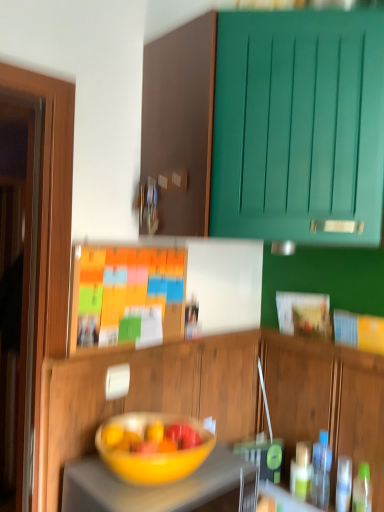
Question: From a real-world perspective, is wooden cabinet at center, which is the 2th cabinetry in top-to-bottom order, physically below matte yellow bowl at center?

Choices:
 (A) yes
 (B) no

Answer: (A)

Question: Is wooden cabinet at center, which is the 1th cabinetry from bottom to top, at the right side of matte yellow bowl at center?

Choices:
 (A) yes
 (B) no

Answer: (B)

Question: Is wooden cabinet at center, which is the 2th cabinetry in top-to-bottom order, closer to the viewer compared to matte yellow bowl at center?

Choices:
 (A) no
 (B) yes

Answer: (A)

Question: Is wooden cabinet at center, which is the 1th cabinetry from bottom to top, directly adjacent to matte yellow bowl at center?

Choices:
 (A) no
 (B) yes

Answer: (A)

Question: Does wooden cabinet at center, which is the 2th cabinetry in top-to-bottom order, have a smaller size compared to matte yellow bowl at center?

Choices:
 (A) no
 (B) yes

Answer: (A)

Question: Is yellow matte bowl at center wider or thinner than wooden cabinet at center, which is the 1th cabinetry from bottom to top?

Choices:
 (A) thin
 (B) wide

Answer: (B)

Question: In the image, is yellow matte bowl at center positioned in front of or behind wooden cabinet at center, which is the 2th cabinetry in top-to-bottom order?

Choices:
 (A) front
 (B) behind

Answer: (A)

Question: Based on their sizes in the image, would you say yellow matte bowl at center is bigger or smaller than wooden cabinet at center, which is the 1th cabinetry from bottom to top?

Choices:
 (A) small
 (B) big

Answer: (B)

Question: From a real-world perspective, relative to wooden cabinet at center, which is the 1th cabinetry from bottom to top, is yellow matte bowl at center vertically above or below?

Choices:
 (A) below
 (B) above

Answer: (A)

Question: In the image, is matte yellow bowl at center on the left side or the right side of orange matte bulletin board at center?

Choices:
 (A) right
 (B) left

Answer: (A)

Question: Is point (173, 419) closer or farther from the camera than point (100, 331)?

Choices:
 (A) closer
 (B) farther

Answer: (B)

Question: Is matte yellow bowl at center wider or thinner than orange matte bulletin board at center?

Choices:
 (A) thin
 (B) wide

Answer: (B)

Question: From the image's perspective, is matte yellow bowl at center positioned above or below orange matte bulletin board at center?

Choices:
 (A) below
 (B) above

Answer: (A)

Question: Does point coord(314,459) appear closer or farther from the camera than point coord(253,483)?

Choices:
 (A) closer
 (B) farther

Answer: (B)

Question: Considering the positions of transparent plastic bottle at right and yellow matte bowl at center in the image, is transparent plastic bottle at right taller or shorter than yellow matte bowl at center?

Choices:
 (A) tall
 (B) short

Answer: (B)